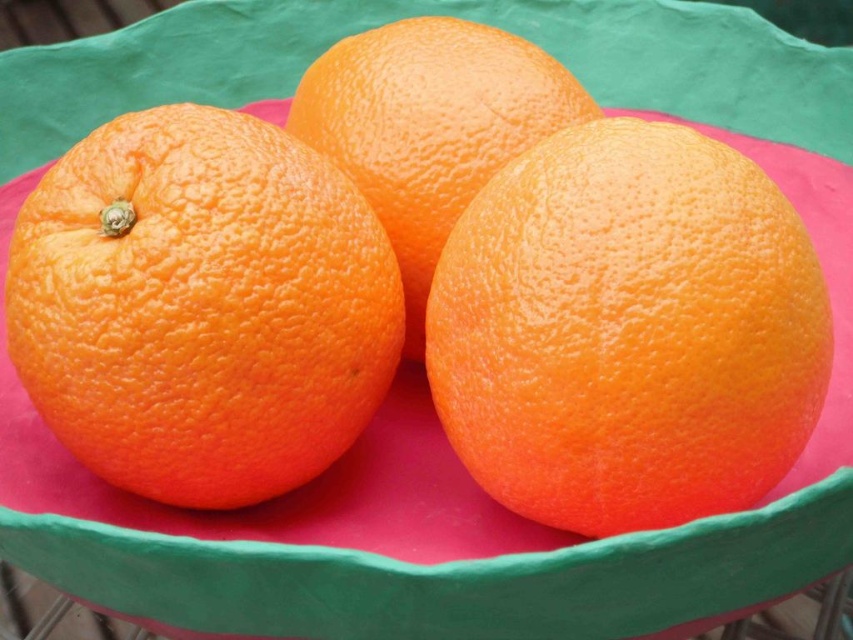
You are standing in front of the three oranges on the green and pink cloth. There are two points marked in the image. If you were to walk towards the point that is closer to you, which point would you choose between point (450, 387) and point (379, 296)?

Point (450, 387) is in front of point (379, 296), so you should choose point (450, 387) as it is closer to you.